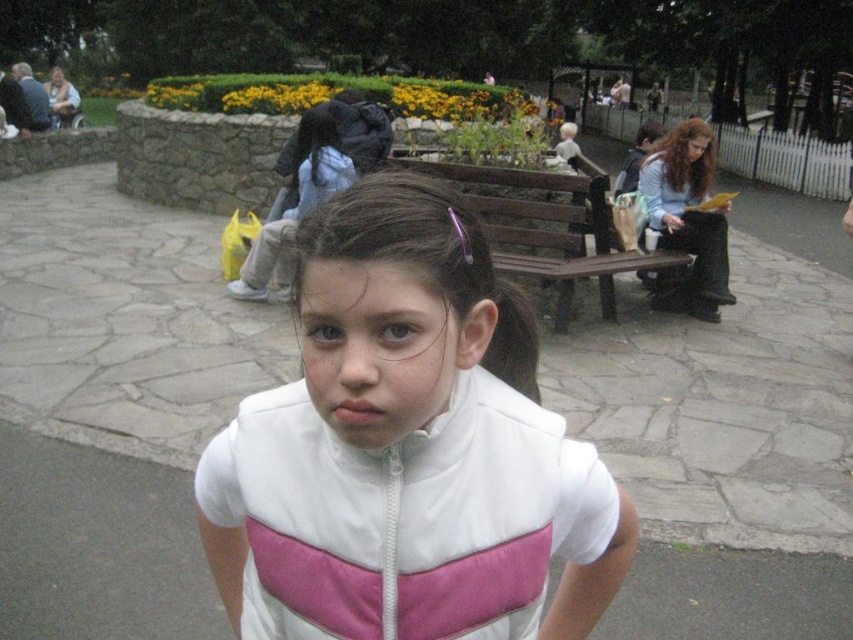
Question: Is brown wooden bench at center to the right of brown hair at center from the viewer's perspective?

Choices:
 (A) yes
 (B) no

Answer: (B)

Question: Which point is farther to the camera?

Choices:
 (A) (553, 413)
 (B) (671, 152)
 (C) (543, 243)

Answer: (B)

Question: Which object is positioned farthest from the white matte jacket at center?

Choices:
 (A) brown hair at center
 (B) brown wooden bench at center

Answer: (A)

Question: Is white matte jacket at center wider than brown wooden bench at center?

Choices:
 (A) yes
 (B) no

Answer: (B)

Question: Among these objects, which one is nearest to the camera?

Choices:
 (A) white matte jacket at center
 (B) brown hair at center
 (C) brown wooden bench at center

Answer: (A)

Question: Is white matte jacket at center to the right of brown hair at center from the viewer's perspective?

Choices:
 (A) no
 (B) yes

Answer: (A)